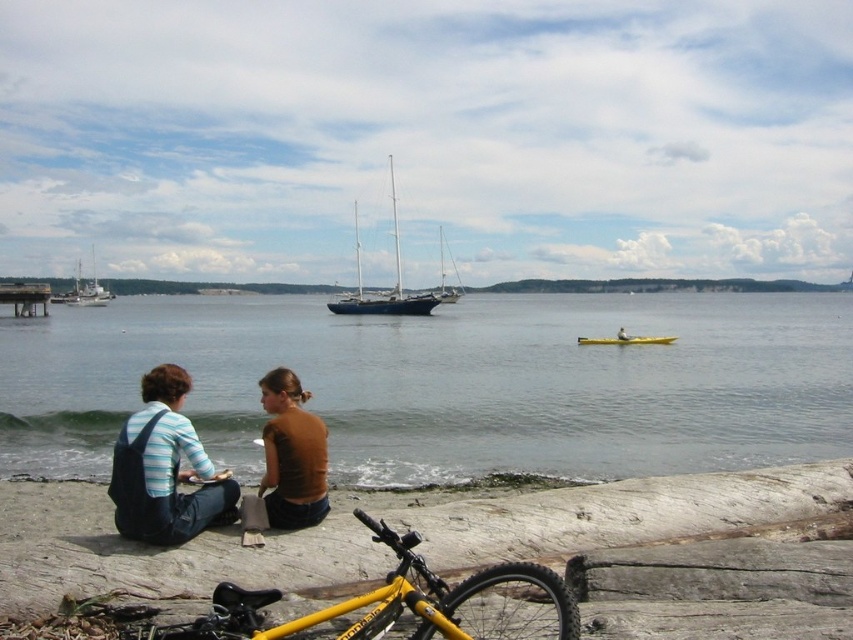
Question: Does clear water at lower left appear on the left side of smooth sand beach at lower left?

Choices:
 (A) yes
 (B) no

Answer: (A)

Question: Among these objects, which one is nearest to the camera?

Choices:
 (A) striped cotton shirt at lower left
 (B) dark blue polished wood sailboat at center
 (C) clear water at lower left
 (D) gold metallic kayak at center

Answer: (A)

Question: Is smooth sand beach at lower left wider than yellow matte bicycle at lower center?

Choices:
 (A) no
 (B) yes

Answer: (B)

Question: Estimate the real-world distances between objects in this image. Which object is closer to the white matte sailboat at left?

Choices:
 (A) wooden dock at left
 (B) brown cotton shirt at lower center
 (C) gold metallic kayak at center
 (D) smooth sand beach at lower left

Answer: (A)

Question: Which object is farther from the camera taking this photo?

Choices:
 (A) white matte sailboat at left
 (B) wooden dock at left
 (C) clear water at lower left
 (D) brown cotton shirt at lower center

Answer: (A)

Question: Can you confirm if smooth sand beach at lower left is wider than yellow matte bicycle at lower center?

Choices:
 (A) yes
 (B) no

Answer: (A)